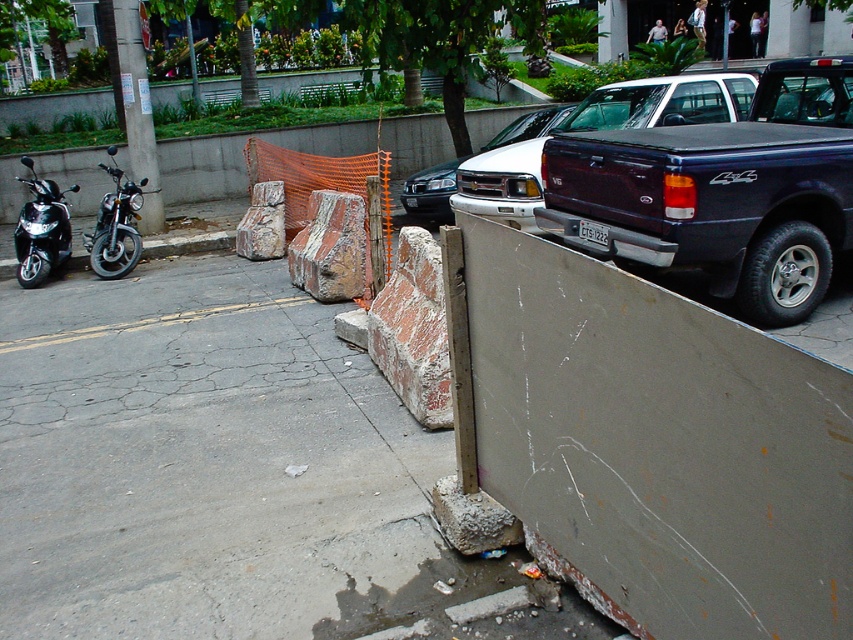
You are a delivery person standing at the entrance of the construction site. You need to reach the shiny black motorcycle at left. What is the shortest path you can take?

The shortest path to the shiny black motorcycle at left would be to go directly to the coordinates where it is located at point [115,227].

You are standing at the point marked by the coordinates point (115, 227) in the image. What object is directly in front of you?

The point (115, 227) indicates a shiny black motorcycle at left, so the shiny black motorcycle at left is directly in front of you.

You are standing in the urban street scene looking at the two points marked in the image. Which point, point (726, 97) or point (94, 241), is nearer to you?

Point (726, 97) is closer to the camera than point (94, 241), so it is nearer to you.